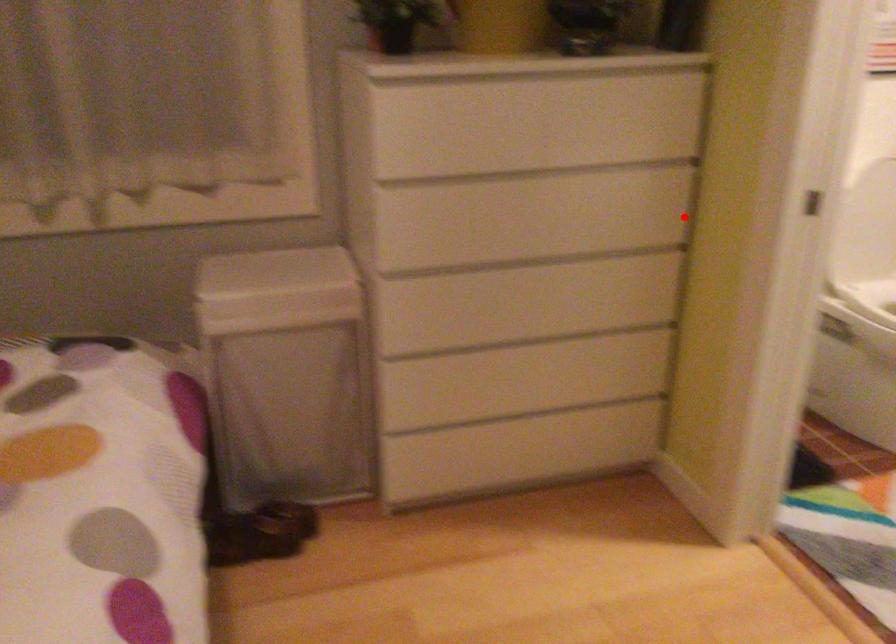
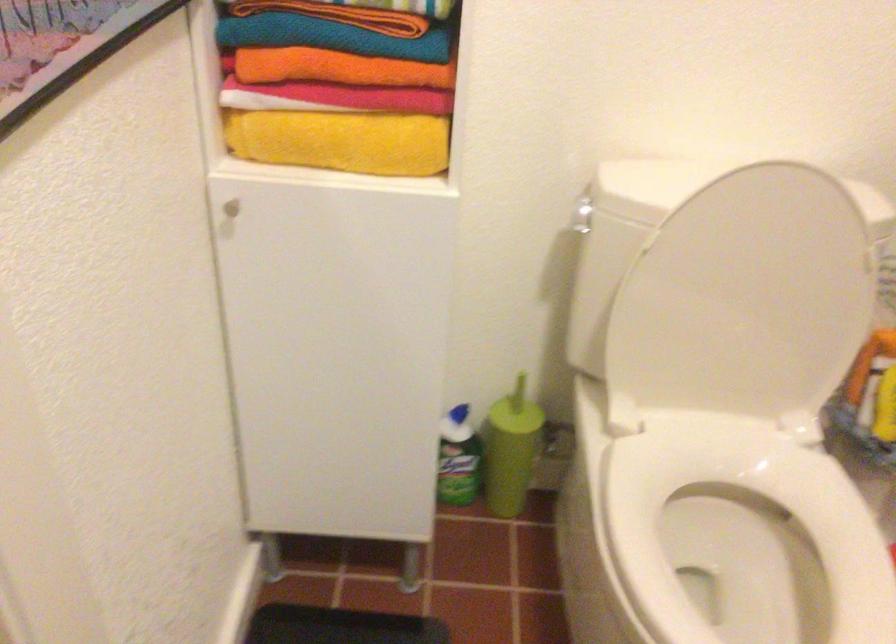
In the second image, find the point that corresponds to the highlighted location in the first image.

(228, 210)